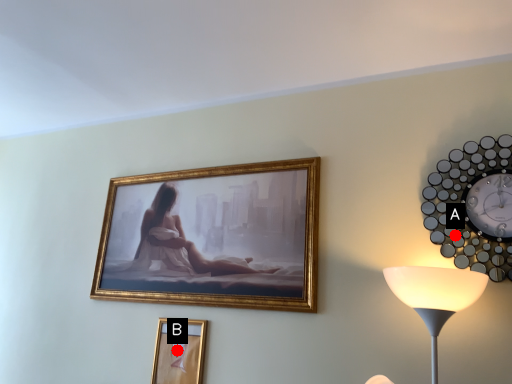
Question: Two points are circled on the image, labeled by A and B beside each circle. Which point appears farthest from the camera in this image?

Choices:
 (A) A is further
 (B) B is further

Answer: (B)